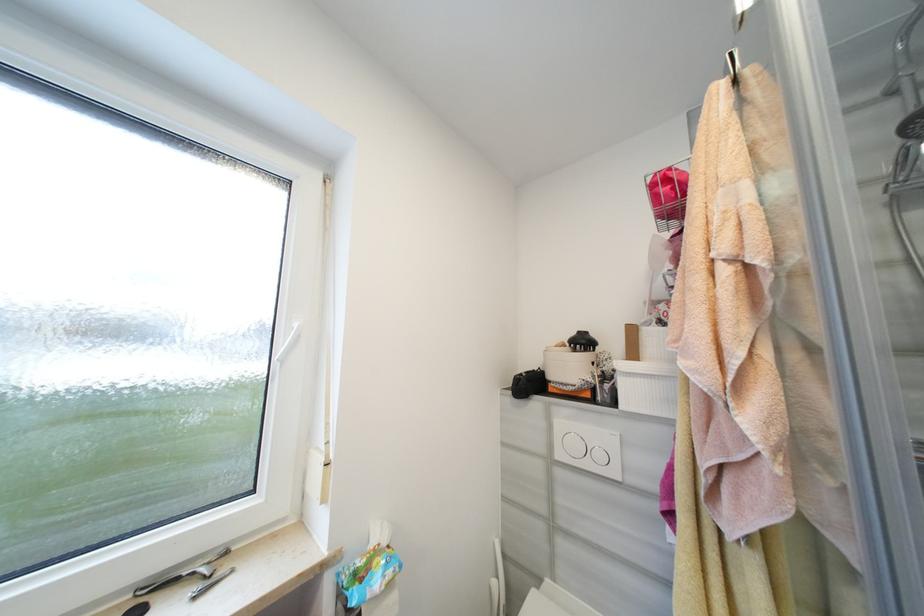
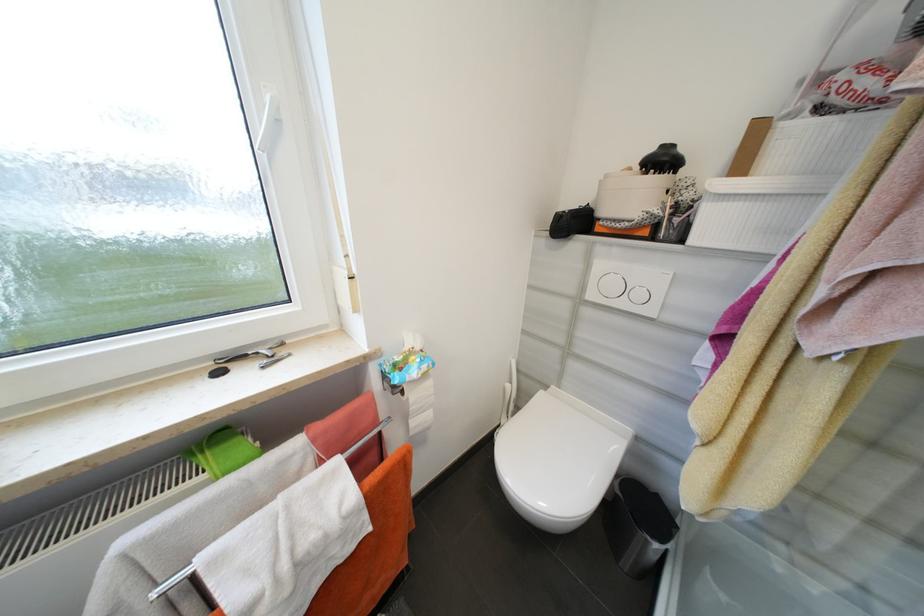
In the second image, find the point that corresponds to (621,405) in the first image.

(687, 241)